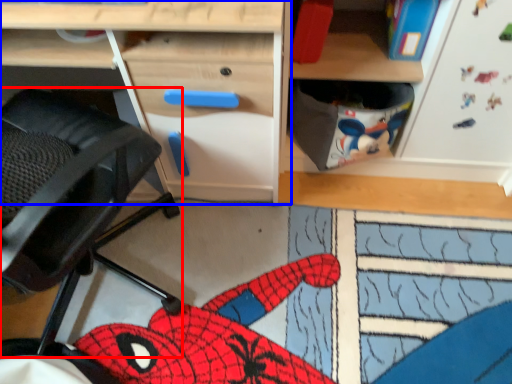
Question: Which point is further to the camera, swivel chair (highlighted by a red box) or desk (highlighted by a blue box)?

Choices:
 (A) swivel chair
 (B) desk

Answer: (B)